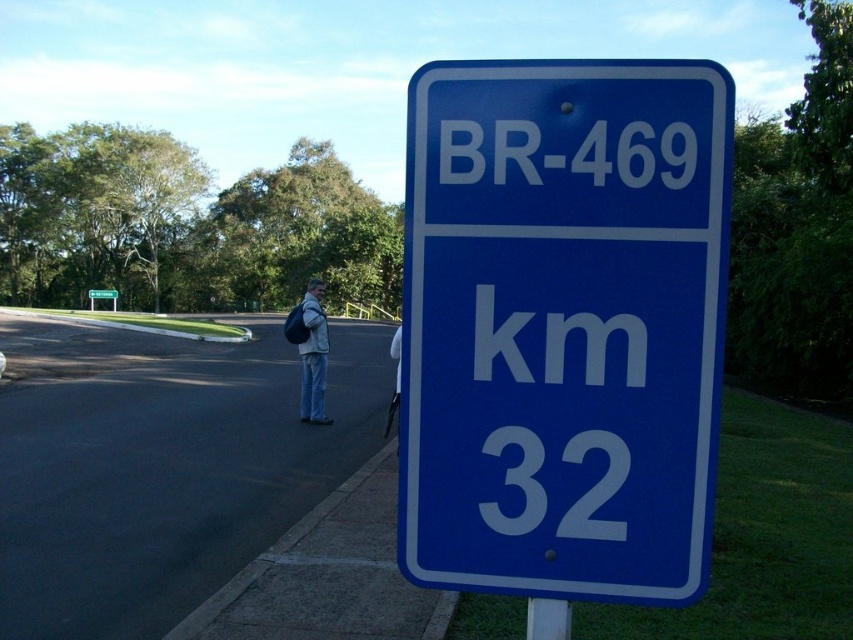
Based on the photo, who is more forward, (321, 284) or (114, 289)?

Positioned in front is point (321, 284).

Where is `light gray jacket at center`? light gray jacket at center is located at coordinates (312, 355).

Is blue metallic sign at center thinner than green plastic sign at upper center?

Yes, blue metallic sign at center is thinner than green plastic sign at upper center.

Is blue metallic sign at center positioned in front of green plastic sign at upper center?

Yes, it is in front of green plastic sign at upper center.

Which is in front, point (706, 428) or point (105, 289)?

Point (706, 428) is in front.

What are the coordinates of `blue metallic sign at center` in the screenshot? It's located at (563, 324).

Describe the element at coordinates (312, 355) in the screenshot. This screenshot has width=853, height=640. I see `light gray jacket at center` at that location.

Who is more distant from viewer, (314, 348) or (554, 621)?

The point (314, 348) is more distant.

The height and width of the screenshot is (640, 853). I want to click on light gray jacket at center, so click(312, 355).

This screenshot has width=853, height=640. Find the location of `light gray jacket at center`. light gray jacket at center is located at coordinates (312, 355).